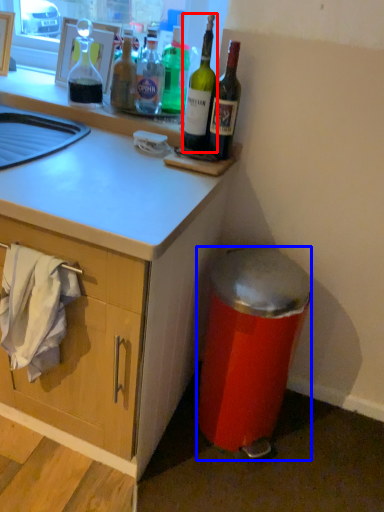
Question: Which point is further to the camera, bottle (highlighted by a red box) or trash bin/can (highlighted by a blue box)?

Choices:
 (A) bottle
 (B) trash bin/can

Answer: (A)